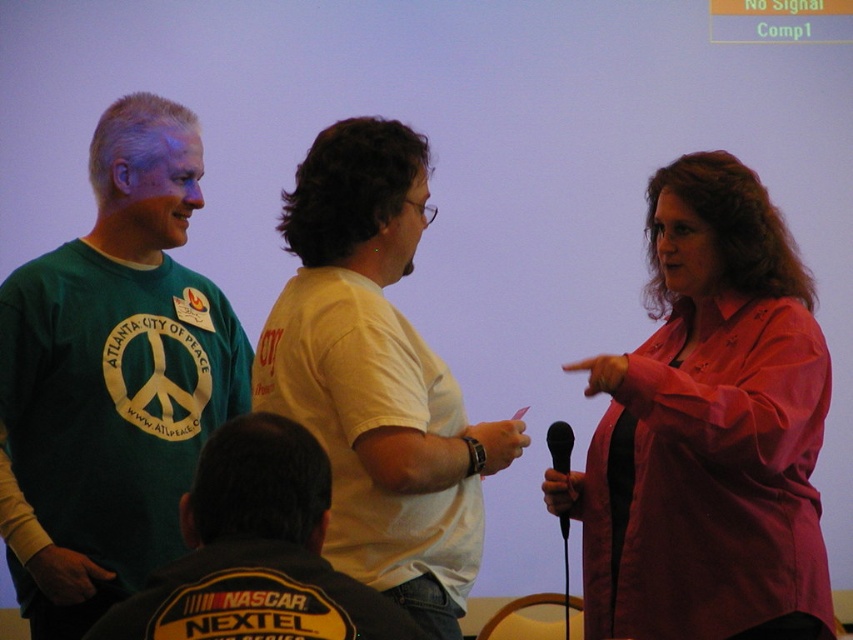
Consider the image. You are a photographer who needs to take a photo of the pink satin blouse at right. The camera you are holding is 7.01 feet away from the blouse. Is this distance sufficient to capture the entire blouse in the frame?

The distance between the pink satin blouse at right and the camera is exactly 7.01 feet, which is sufficient to capture the entire blouse in the frame as long as the camera has a wide enough lens or the photographer steps back slightly if needed.